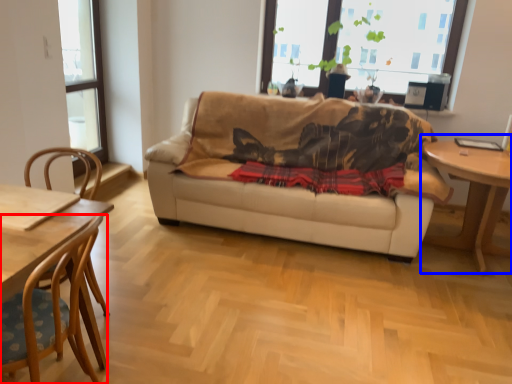
Question: Which of the following is the farthest to the observer, chair (highlighted by a red box) or table (highlighted by a blue box)?

Choices:
 (A) chair
 (B) table

Answer: (B)